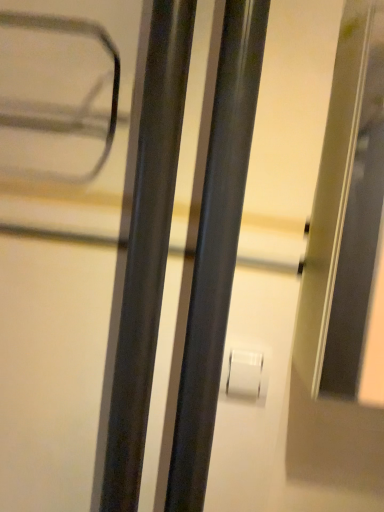
I want to click on white matte toilet paper at center, so click(244, 374).

Based on the photo, what is the approximate height of white matte toilet paper at center?

white matte toilet paper at center is 3.52 inches tall.

This screenshot has height=512, width=384. Describe the element at coordinates (244, 374) in the screenshot. I see `white matte toilet paper at center` at that location.

Where is `white matte toilet paper at center`? The width and height of the screenshot is (384, 512). white matte toilet paper at center is located at coordinates (244, 374).